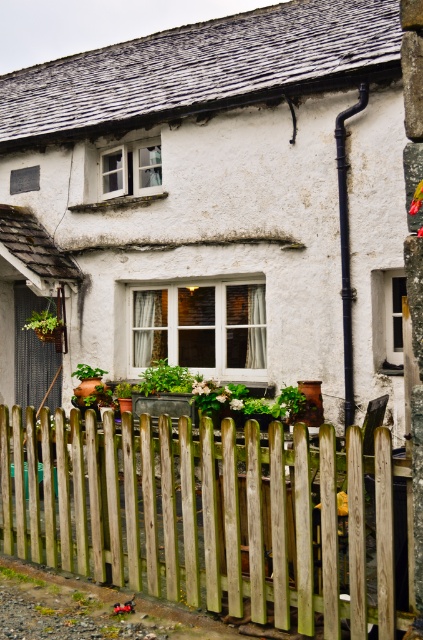
You are a painter who needs to paint both the white matte wooden fence at lower center and the weathered wood fence at lower center. If your ladder can reach up to 15 feet, can you safely paint both fences without moving the ladder?

The white matte wooden fence at lower center is 15.42 feet from the weathered wood fence at lower center. Since the ladder can only reach up to 15 feet, you cannot safely paint both fences without moving the ladder because the distance between them exceeds the ladder height limit.

You are a painter hired to paint the fences in front of the house. You have to paint both the white matte wooden fence at lower center and the weathered wood fence at lower center. Which fence do you need to use a ladder to reach the top?

The white matte wooden fence at lower center is much taller than the weathered wood fence at lower center, so you need to use a ladder to reach the top of the white matte wooden fence at lower center.